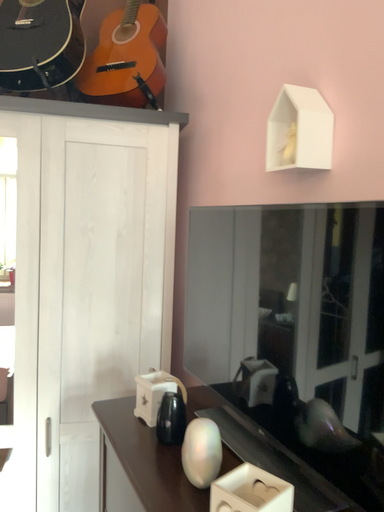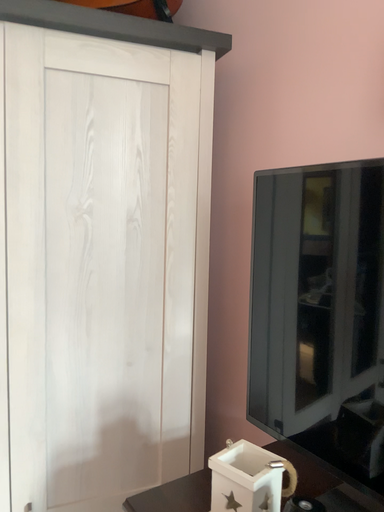
Question: How did the camera likely rotate when shooting the video?

Choices:
 (A) rotated left
 (B) rotated right

Answer: (B)